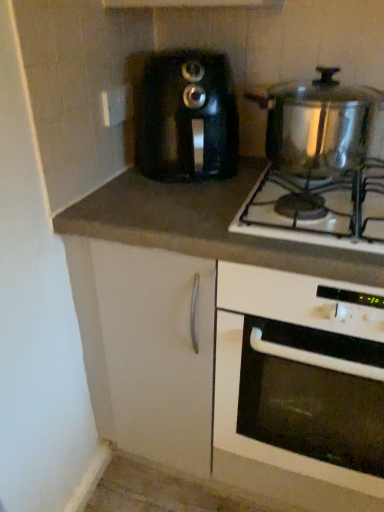
Question: Is dark gray laminate countertop at center at the back of black plastic toaster at center?

Choices:
 (A) no
 (B) yes

Answer: (A)

Question: Considering the relative sizes of black plastic toaster at center and dark gray laminate countertop at center in the image provided, is black plastic toaster at center smaller than dark gray laminate countertop at center?

Choices:
 (A) yes
 (B) no

Answer: (A)

Question: Does black plastic toaster at center lie in front of dark gray laminate countertop at center?

Choices:
 (A) no
 (B) yes

Answer: (A)

Question: From a real-world perspective, is black plastic toaster at center beneath dark gray laminate countertop at center?

Choices:
 (A) yes
 (B) no

Answer: (B)

Question: Is black plastic toaster at center at the right side of dark gray laminate countertop at center?

Choices:
 (A) no
 (B) yes

Answer: (B)

Question: Do you think shiny metallic pot at upper right is within black plastic toaster at center, or outside of it?

Choices:
 (A) outside
 (B) inside

Answer: (A)

Question: Does point (301, 117) appear closer or farther from the camera than point (180, 74)?

Choices:
 (A) closer
 (B) farther

Answer: (B)

Question: Looking at their shapes, would you say shiny metallic pot at upper right is wider or thinner than black plastic toaster at center?

Choices:
 (A) thin
 (B) wide

Answer: (A)

Question: In the image, is shiny metallic pot at upper right on the left side or the right side of black plastic toaster at center?

Choices:
 (A) right
 (B) left

Answer: (A)

Question: Visually, is shiny metallic pot at upper right positioned to the left or to the right of white glossy oven at center?

Choices:
 (A) right
 (B) left

Answer: (B)

Question: From the image's perspective, is shiny metallic pot at upper right above or below white glossy oven at center?

Choices:
 (A) below
 (B) above

Answer: (B)

Question: In the image, is shiny metallic pot at upper right positioned in front of or behind white glossy oven at center?

Choices:
 (A) behind
 (B) front

Answer: (A)

Question: From a real-world perspective, is shiny metallic pot at upper right positioned above or below white glossy oven at center?

Choices:
 (A) above
 (B) below

Answer: (A)

Question: From the image's perspective, is white glossy oven at center located above or below black plastic toaster at center?

Choices:
 (A) below
 (B) above

Answer: (A)

Question: In terms of width, does white glossy oven at center look wider or thinner when compared to black plastic toaster at center?

Choices:
 (A) thin
 (B) wide

Answer: (B)